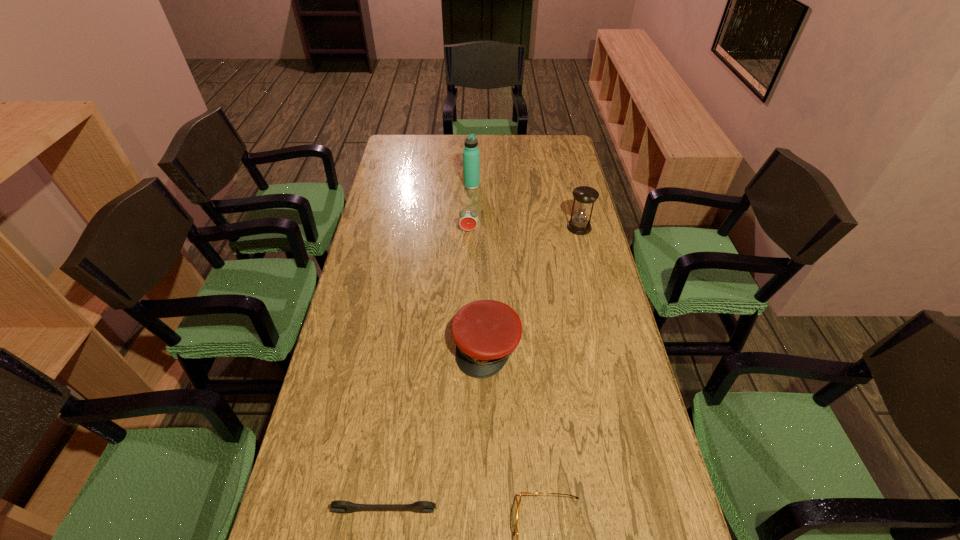
Find the location of a particular element. This screenshot has height=540, width=960. free space located on the front of the fourth farthest object with an emblem is located at coordinates (489, 524).

You are a GUI agent. You are given a task and a screenshot of the screen. Output one action in this format:
    pyautogui.click(x=<x>, y=<y>)
    Task: Click on the object positioned at the left edge
    
    Given the screenshot: What is the action you would take?
    pyautogui.click(x=344, y=507)

I want to click on object that is at the right edge, so click(585, 196).

What are the coordinates of `vacant space at the far edge` in the screenshot? It's located at (491, 146).

The width and height of the screenshot is (960, 540). Identify the location of vacant space at the left edge of the desktop. (391, 194).

I want to click on free space at the right edge of the desktop, so click(549, 207).

Where is `vacant space at the far left corner of the desktop`? This screenshot has width=960, height=540. vacant space at the far left corner of the desktop is located at coordinates (388, 159).

Where is `vacant space at the far right corner`? vacant space at the far right corner is located at coordinates point(568,149).

Where is `empty location between the wrench and the alarm clock`? empty location between the wrench and the alarm clock is located at coordinates (426, 371).

You are a GUI agent. You are given a task and a screenshot of the screen. Output one action in this format:
    pyautogui.click(x=<x>, y=<y>)
    Task: Click on the vacant space that is in between the tallest object and the alarm clock
    This screenshot has height=540, width=960.
    Given the screenshot: What is the action you would take?
    pyautogui.click(x=470, y=208)